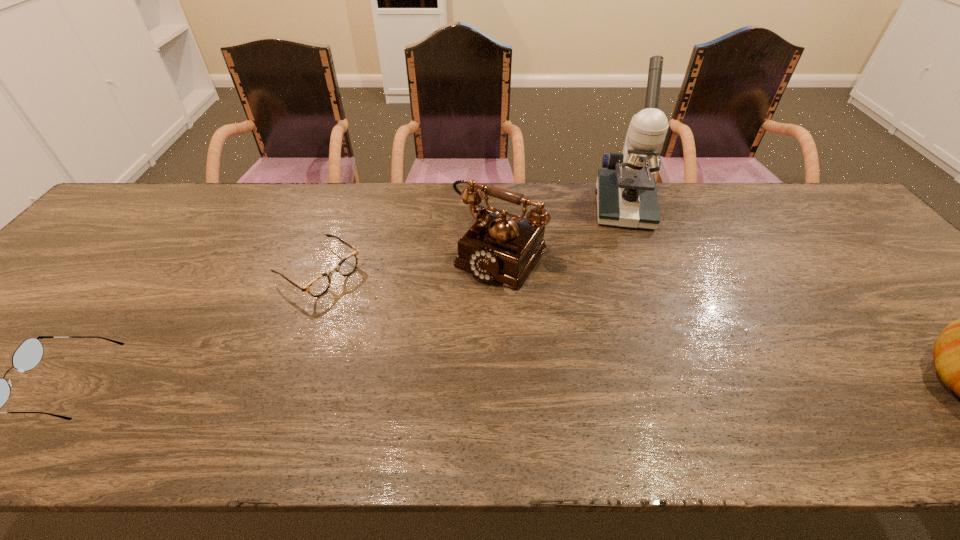
Image resolution: width=960 pixels, height=540 pixels. Identify the location of vacant space at the near left corner of the desktop. (6, 380).

Find the location of `free spot at the far right corner of the desktop`. free spot at the far right corner of the desktop is located at coordinates (810, 208).

Locate which object is the second closest to the third shortest object. Please provide its 2D coordinates. Your answer should be formatted as a tuple, i.e. [(x, y)], where the tuple contains the x and y coordinates of a point satisfying the conditions above.

[(500, 246)]

Locate which object is the third closest to the right spectacles. Please provide its 2D coordinates. Your answer should be formatted as a tuple, i.e. [(x, y)], where the tuple contains the x and y coordinates of a point satisfying the conditions above.

[(626, 192)]